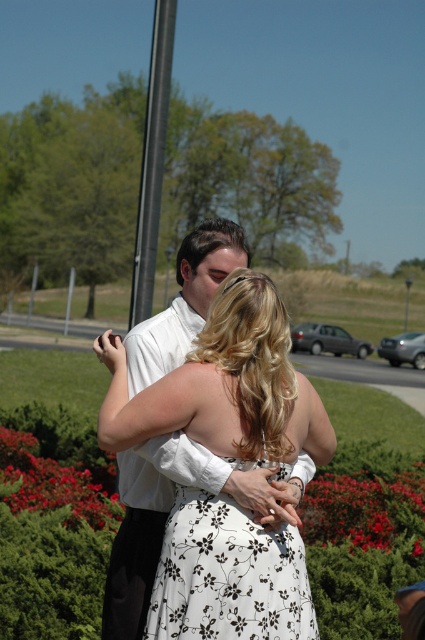
Consider the image. Can you confirm if black smooth pole at upper center is taller than silver metallic sedan at center?

Indeed, black smooth pole at upper center has a greater height compared to silver metallic sedan at center.

Is black smooth pole at upper center closer to the viewer compared to silver metallic sedan at center?

Yes, black smooth pole at upper center is in front of silver metallic sedan at center.

Is point (147, 252) closer to camera compared to point (317, 324)?

Yes.

The image size is (425, 640). I want to click on black smooth pole at upper center, so click(x=153, y=161).

Does white floral fabric dress at center have a lesser width compared to silver metallic sedan at center?

Yes, white floral fabric dress at center is thinner than silver metallic sedan at center.

Who is higher up, white floral fabric dress at center or silver metallic sedan at center?

Positioned higher is silver metallic sedan at center.

Is point (201, 554) more distant than point (337, 336)?

No, it is in front of (337, 336).

The image size is (425, 640). Find the location of `white floral fabric dress at center`. white floral fabric dress at center is located at coordinates (227, 573).

I want to click on white floral fabric dress at center, so 227,573.

Can you confirm if white floral fabric dress at center is shorter than silver metallic sedan at lower right?

Yes, white floral fabric dress at center is shorter than silver metallic sedan at lower right.

You are a GUI agent. You are given a task and a screenshot of the screen. Output one action in this format:
    pyautogui.click(x=<x>, y=<y>)
    Task: Click on the white floral fabric dress at center
    The image size is (425, 640).
    Given the screenshot: What is the action you would take?
    pyautogui.click(x=227, y=573)

Locate an element on the screen. The width and height of the screenshot is (425, 640). white floral fabric dress at center is located at coordinates (227, 573).